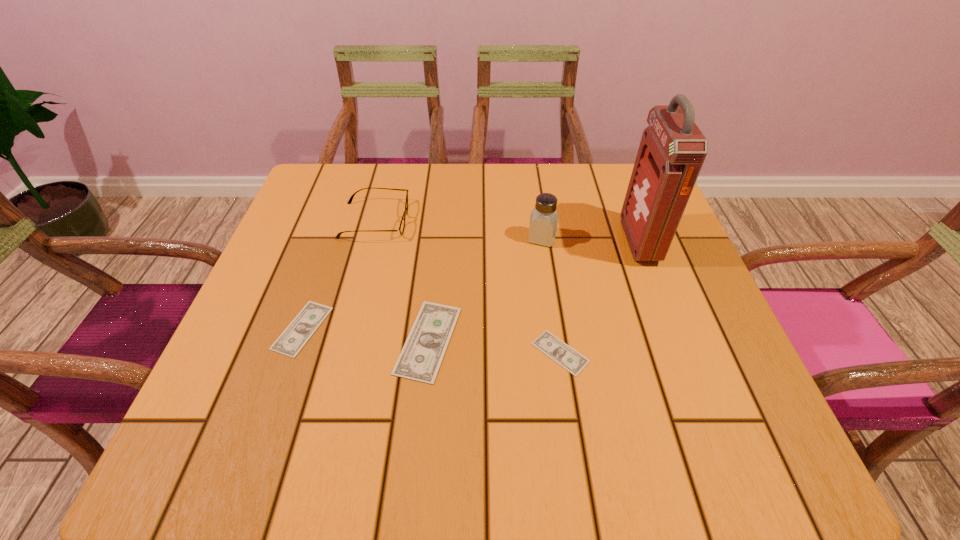
The image size is (960, 540). I want to click on spectacles located in the left edge section of the desktop, so [x=402, y=225].

Locate an element on the screen. This screenshot has height=540, width=960. object at the right edge is located at coordinates (672, 150).

I want to click on object present at the far left corner, so click(x=402, y=225).

Find the location of a particular element. The width and height of the screenshot is (960, 540). free point at the far edge is located at coordinates (447, 189).

Locate an element on the screen. vacant space at the near edge of the desktop is located at coordinates (413, 399).

Where is `free point at the left edge`? free point at the left edge is located at coordinates (306, 348).

The height and width of the screenshot is (540, 960). In the image, there is a desktop. In order to click on vacant area at the right edge in this screenshot , I will do `click(626, 253)`.

The height and width of the screenshot is (540, 960). Identify the location of free space at the far left corner of the desktop. (359, 189).

Where is `free space at the far right corner of the desktop`? free space at the far right corner of the desktop is located at coordinates tap(590, 169).

This screenshot has height=540, width=960. I want to click on vacant space at the near right corner of the desktop, so click(714, 409).